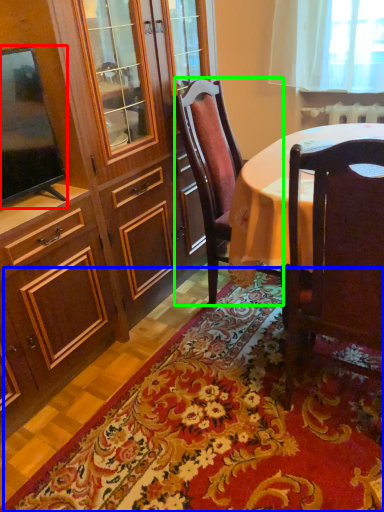
Question: Which object is positioned farthest from television (highlighted by a red box)? Select from mat (highlighted by a blue box) and chair (highlighted by a green box).

Choices:
 (A) mat
 (B) chair

Answer: (A)